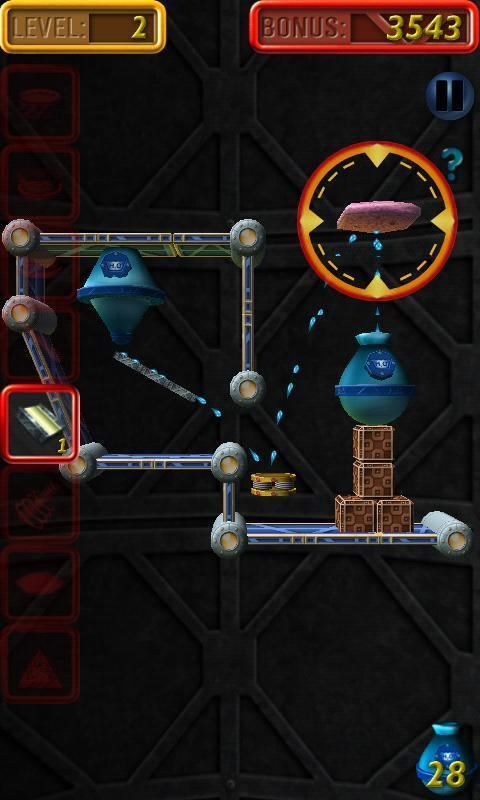
Where is `small brown box`? The height and width of the screenshot is (800, 480). small brown box is located at coordinates (372, 446), (386, 478), (358, 512), (390, 512).